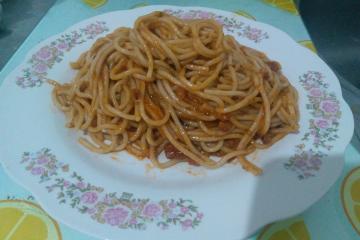
Identify the location of table cloth. (62, 17).